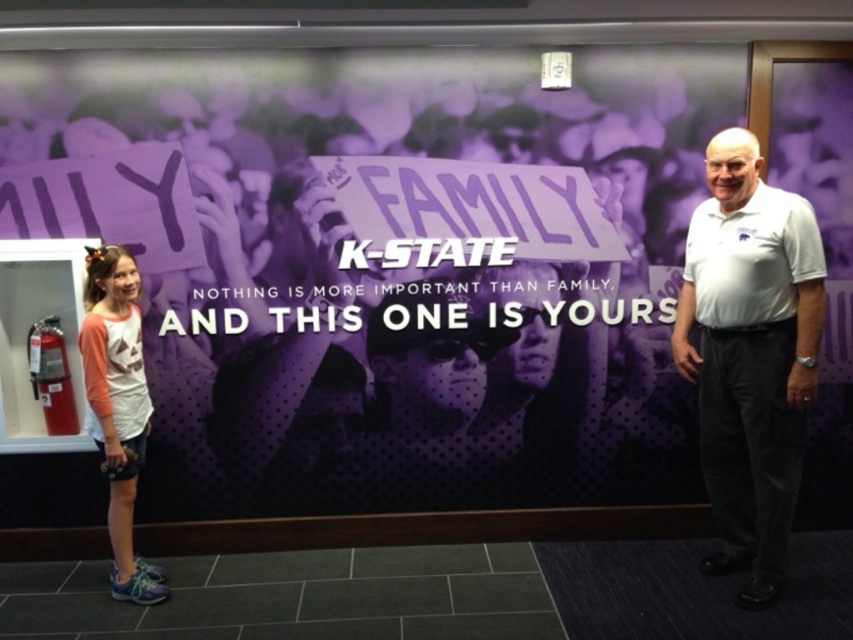
Is white cotton polo shirt at right taller than matte pink shirt at left?

Yes, white cotton polo shirt at right is taller than matte pink shirt at left.

Which is below, white cotton polo shirt at right or matte pink shirt at left?

matte pink shirt at left is below.

Where is `white cotton polo shirt at right`? white cotton polo shirt at right is located at coordinates (750, 355).

Is purple matte banner at center bigger than matte pink shirt at left?

Yes, purple matte banner at center is bigger than matte pink shirt at left.

The width and height of the screenshot is (853, 640). Describe the element at coordinates (386, 266) in the screenshot. I see `purple matte banner at center` at that location.

Measure the distance between point (165,456) and camera.

Point (165,456) is 3.27 meters from camera.

At what (x,y) coordinates should I click in order to perform the action: click on purple matte banner at center. Please return your answer as a coordinate pair (x, y). The height and width of the screenshot is (640, 853). Looking at the image, I should click on (386, 266).

Can you confirm if purple matte banner at center is positioned to the right of white cotton polo shirt at right?

Incorrect, purple matte banner at center is not on the right side of white cotton polo shirt at right.

Does point (663, 461) lie in front of point (714, 154)?

No, it is behind (714, 154).

The image size is (853, 640). In order to click on purple matte banner at center in this screenshot , I will do `click(386, 266)`.